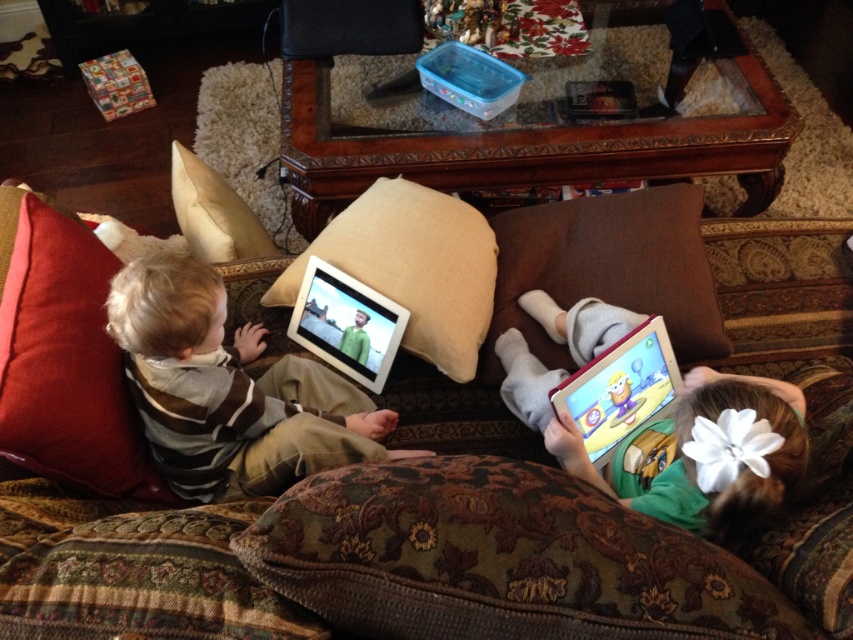
Question: Is red cotton pillow at left bigger than beige fabric pillow at upper left?

Choices:
 (A) no
 (B) yes

Answer: (B)

Question: Which object appears closest to the camera in this image?

Choices:
 (A) beige fabric pillow at upper left
 (B) beige fabric pillow at center
 (C) matte white tablet at center
 (D) red cotton pillow at left

Answer: (D)

Question: Can you confirm if velvet-patterned couch at center is positioned to the right of red cotton pillow at left?

Choices:
 (A) yes
 (B) no

Answer: (A)

Question: Which point appears closest to the camera in this image?

Choices:
 (A) (376, 305)
 (B) (248, 236)
 (C) (659, 342)
 (D) (90, 236)

Answer: (D)

Question: Which of the following is the farthest from the observer?

Choices:
 (A) beige fabric pillow at center
 (B) velvet-patterned couch at center
 (C) brown fabric pillow at right

Answer: (C)

Question: Observing the image, what is the correct spatial positioning of velvet-patterned couch at center in reference to beige fabric pillow at upper left?

Choices:
 (A) below
 (B) above

Answer: (A)